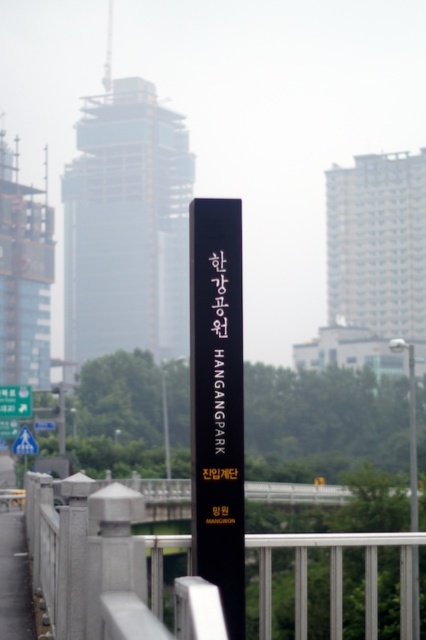
You are standing at the entrance of Hangang Park and see the smooth stone railing at center and the blue plastic traffic sign at upper left. Which object is located to the right of the other?

The smooth stone railing at center is positioned on the right side of blue plastic traffic sign at upper left.

You are standing at the entrance of Hangang Park and notice two objects in the scene. One is the smooth stone railing at center and the other is the blue plastic traffic sign at upper left. Which of these two objects is wider?

The smooth stone railing at center is wider than the blue plastic traffic sign at upper left.